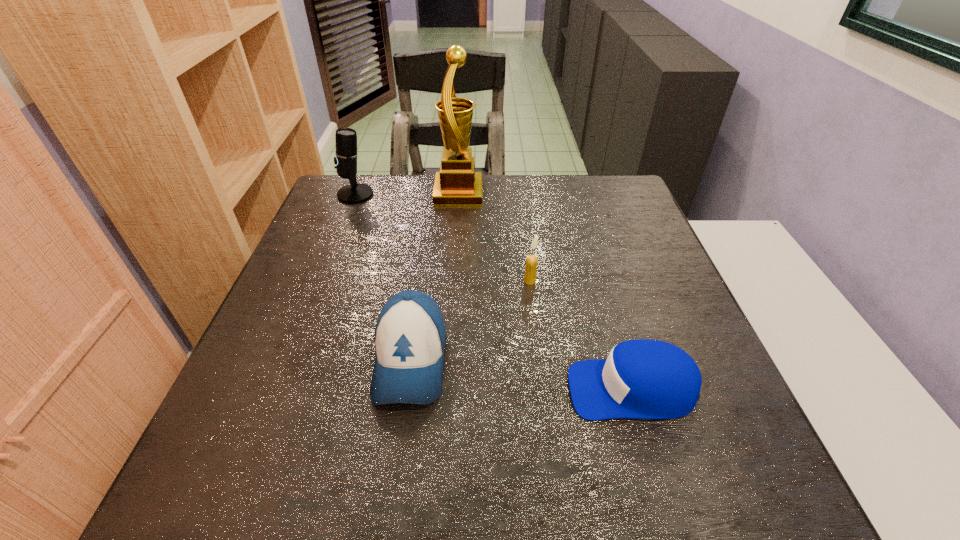
Locate an element on the screen. This screenshot has width=960, height=540. free point between the fourth shortest object and the award is located at coordinates (407, 194).

I want to click on free space between the microphone and the taller baseball cap, so click(x=383, y=277).

At what (x,y) coordinates should I click in order to perform the action: click on unoccupied position between the leftmost object and the tallest object. Please return your answer as a coordinate pair (x, y). This screenshot has height=540, width=960. Looking at the image, I should click on (407, 194).

At what (x,y) coordinates should I click in order to perform the action: click on free spot between the award and the taller baseball cap. Please return your answer as a coordinate pair (x, y). The image size is (960, 540). Looking at the image, I should click on (435, 276).

This screenshot has width=960, height=540. I want to click on vacant area that lies between the tallest object and the taller baseball cap, so [x=435, y=276].

The height and width of the screenshot is (540, 960). In order to click on free space that is in between the left baseball cap and the award in this screenshot , I will do `click(435, 276)`.

I want to click on the closest object to the shorter baseball cap, so click(531, 261).

Locate which object ranks third in proximity to the leftmost object. Please provide its 2D coordinates. Your answer should be formatted as a tuple, i.e. [(x, y)], where the tuple contains the x and y coordinates of a point satisfying the conditions above.

[(531, 261)]

You are a GUI agent. You are given a task and a screenshot of the screen. Output one action in this format:
    pyautogui.click(x=<x>, y=<y>)
    Task: Click on the free space that satisfies the following two spatial constraints: 1. on the front-facing side of the tallest object; 2. on the front side of the leftmost object
    The height and width of the screenshot is (540, 960).
    Given the screenshot: What is the action you would take?
    pyautogui.click(x=459, y=194)

At what (x,y) coordinates should I click in order to perform the action: click on vacant position in the image that satisfies the following two spatial constraints: 1. on the front-facing side of the award; 2. on the left side of the fourth object from left to right. Please return your answer as a coordinate pair (x, y). Image resolution: width=960 pixels, height=540 pixels. Looking at the image, I should click on click(x=452, y=281).